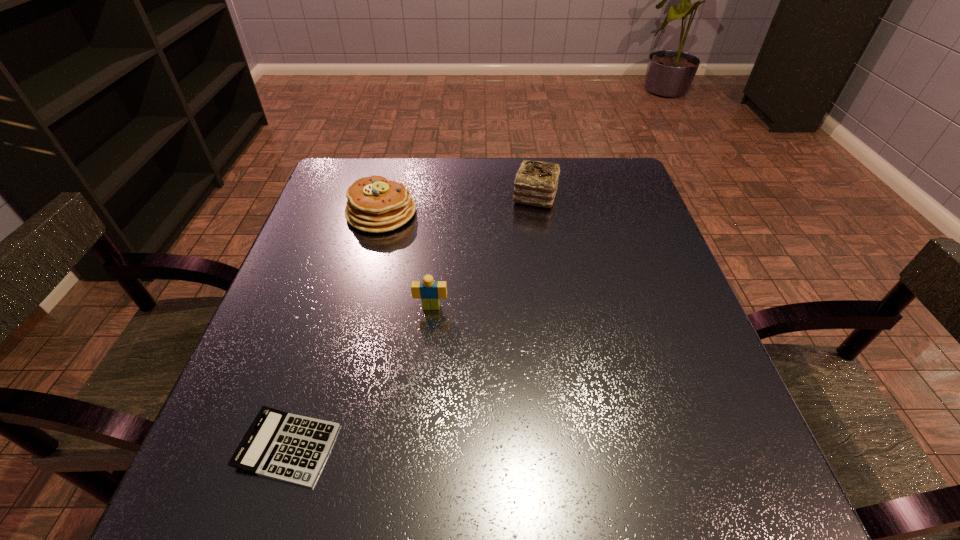
At what (x,y) coordinates should I click in order to perform the action: click on chocolate cake that is at the far edge. Please return your answer as a coordinate pair (x, y). Looking at the image, I should click on (536, 182).

What are the coordinates of `pancake that is at the far edge` in the screenshot? It's located at (374, 204).

Find the location of a particular element. object that is at the near edge is located at coordinates (287, 447).

Where is `pancake located at the left edge`? This screenshot has width=960, height=540. pancake located at the left edge is located at coordinates (374, 204).

Where is `calculator located in the left edge section of the desktop`? The width and height of the screenshot is (960, 540). calculator located in the left edge section of the desktop is located at coordinates (287, 447).

The image size is (960, 540). Find the location of `object at the far left corner`. object at the far left corner is located at coordinates (374, 204).

This screenshot has width=960, height=540. Identify the location of object positioned at the near left corner. (287, 447).

Locate an element on the screen. vacant region at the far edge of the desktop is located at coordinates (510, 170).

At what (x,y) coordinates should I click in order to perform the action: click on free space at the near edge of the desktop. Please return your answer as a coordinate pair (x, y). The image size is (960, 540). Looking at the image, I should click on (316, 519).

The image size is (960, 540). In order to click on vacant area at the left edge in this screenshot , I will do `click(313, 275)`.